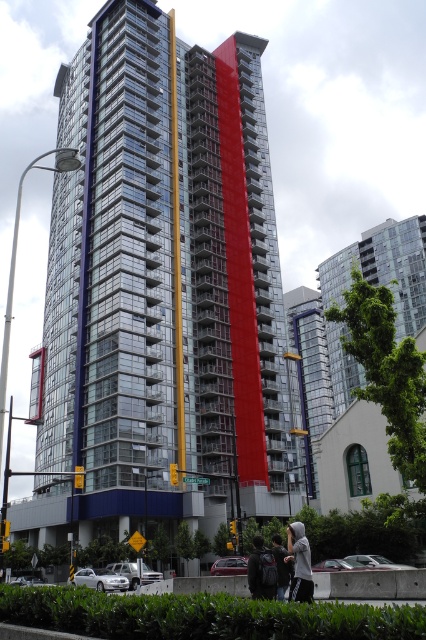
Question: Considering the real-world distances, which object is closest to the dark gray backpack at center?

Choices:
 (A) gray hoodie at lower center
 (B) gray hoodie at center

Answer: (B)

Question: Estimate the real-world distances between objects in this image. Which object is closer to the dark gray backpack at center?

Choices:
 (A) gray hoodie at center
 (B) gray hoodie at lower center

Answer: (A)

Question: Estimate the real-world distances between objects in this image. Which object is farther from the gray hoodie at lower center?

Choices:
 (A) gray hoodie at center
 (B) dark gray backpack at center

Answer: (A)

Question: Does dark gray backpack at center appear on the right side of gray hoodie at lower center?

Choices:
 (A) yes
 (B) no

Answer: (B)

Question: Is gray hoodie at center in front of dark gray backpack at center?

Choices:
 (A) no
 (B) yes

Answer: (A)

Question: Is gray hoodie at center bigger than gray hoodie at lower center?

Choices:
 (A) no
 (B) yes

Answer: (A)